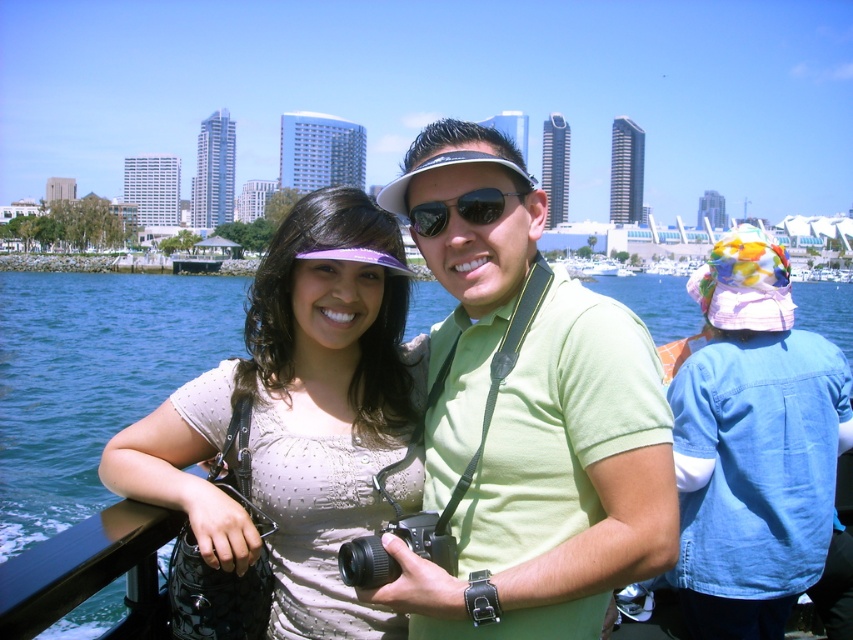
You are a photographer trying to frame a shot of the green matte shirt at center in the image. The camera you are using has a rectangular viewfinder with a 16x9 aspect ratio. Given that the shirt is at coordinates point 0.756, 0.655, can you determine if the shirt will be fully visible within the viewfinder?

The green matte shirt at center is positioned at point (558, 483). Since the viewfinder has a 16x9 aspect ratio, the shirt is within the bounds of the viewfinder and will be fully visible.

You are standing at the edge of a dock and see a person wearing a green matte shirt at center. If you want to take a photo of them using a camera with a maximum focus range of 50 meters, will you be able to capture them clearly?

The green matte shirt at center is 47.24 meters away from viewer. Since the distance is within the camera maximum focus range of 50 meters, you can capture them clearly.